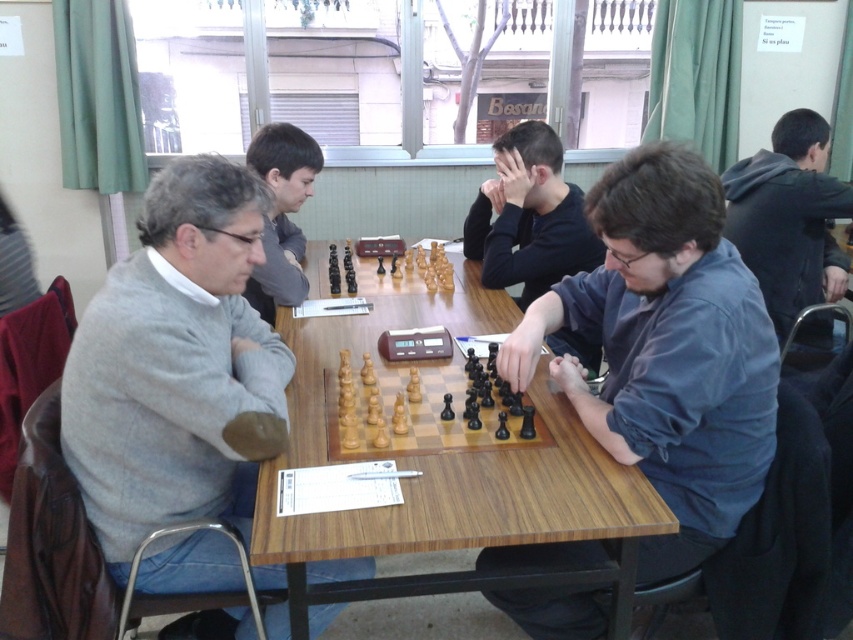
You are organizing a chess tournament and need to ensure that the wooden chess set at center fits properly on the wooden chessboard at center. Based on the image, can you confirm if the chessboard is large enough to accommodate all the pieces of the chess set?

The wooden chessboard at center has a larger size compared to wooden chess set at center, so yes, the chessboard is large enough to accommodate all the pieces of the chess set.

You are a photographer at the chess match and want to take a photo of both the blue shirt at center and the dark gray hoodie at center. Since you want to highlight both equally, which clothing item should you adjust the camera focus on to ensure both are in frame and properly sized?

The blue shirt at center is bigger than dark gray hoodie at center, so you should focus on the blue shirt at center to ensure both are properly sized in the photo.

You are a photographer positioned in front of the chessboard. You want to take a photo that includes both the light wood chess set at center and the smooth gray sweater at upper left. Which object should you focus on first to ensure both are in sharp focus?

The light wood chess set at center is closer to the viewer than the smooth gray sweater at upper left. To ensure both are in sharp focus, focus on the closer object, the light wood chess set at center, as it will be within the depth of field when the farther object is also in focus.